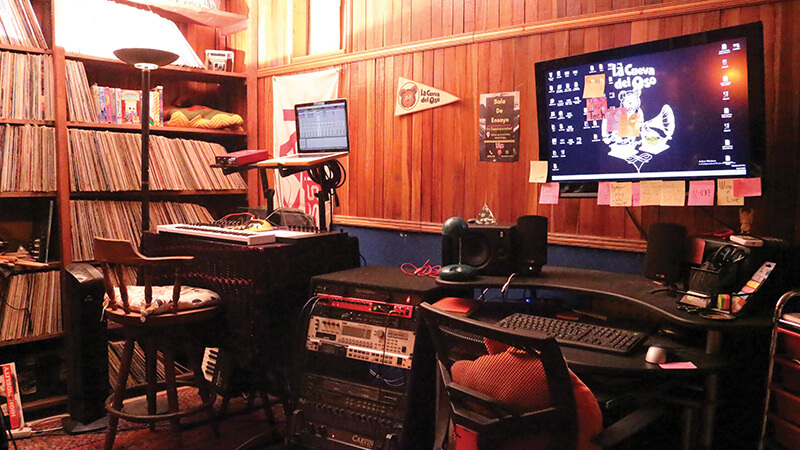
Find the location of a particular element. The height and width of the screenshot is (450, 800). stool is located at coordinates (122, 293).